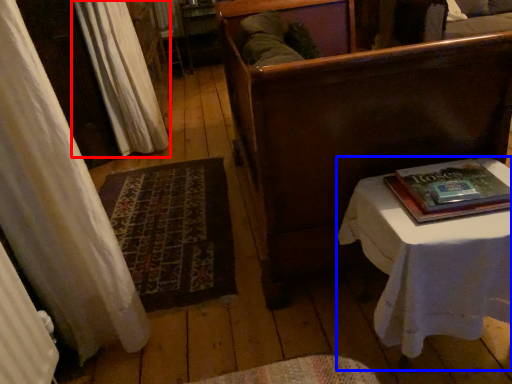
Question: Among these objects, which one is nearest to the camera, curtain (highlighted by a red box) or table (highlighted by a blue box)?

Choices:
 (A) curtain
 (B) table

Answer: (B)